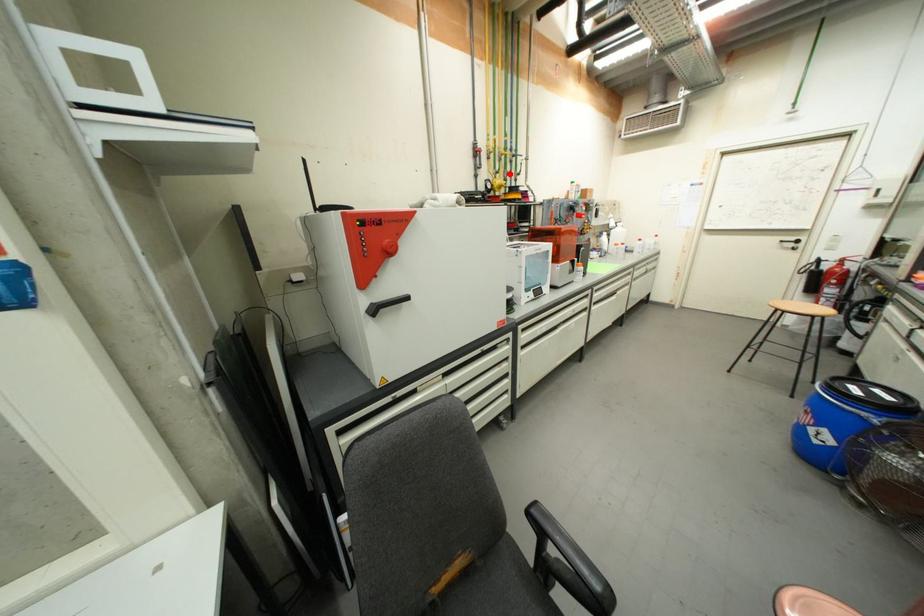
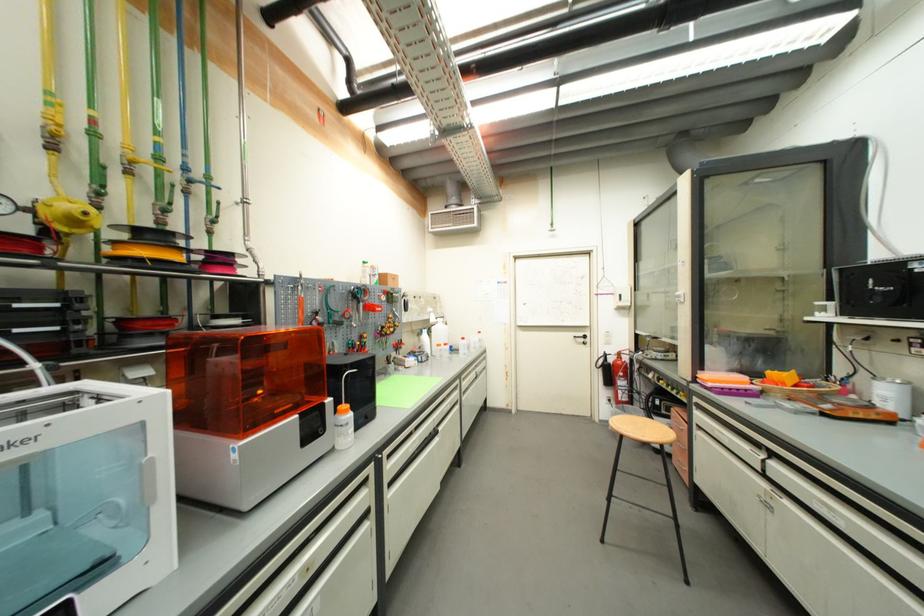
Question: I am providing you with two images of the same scene from different viewpoints. In image1, a red point is highlighted. Considering the same 3D point in image2, which of the following is correct?

Choices:
 (A) It is closer
 (B) It is farther

Answer: (B)